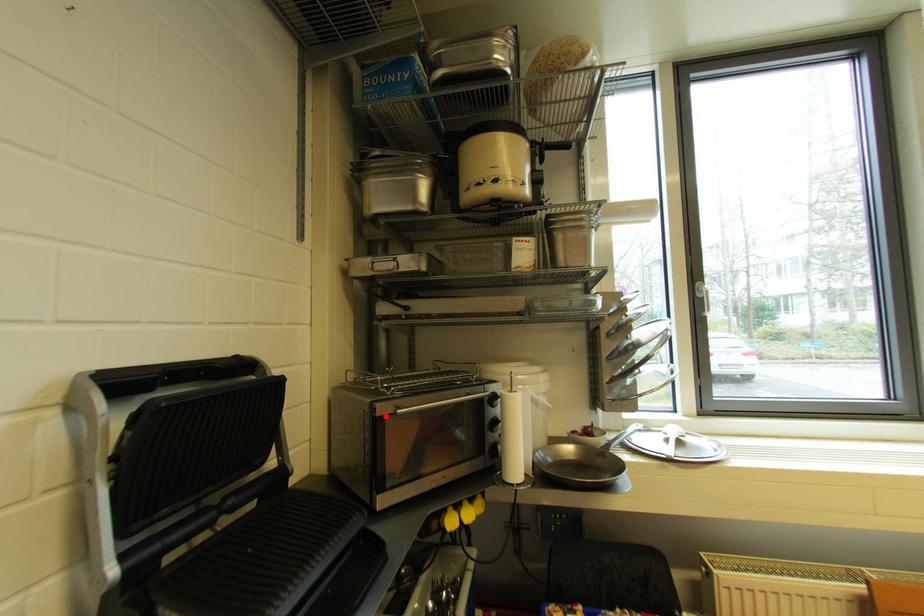
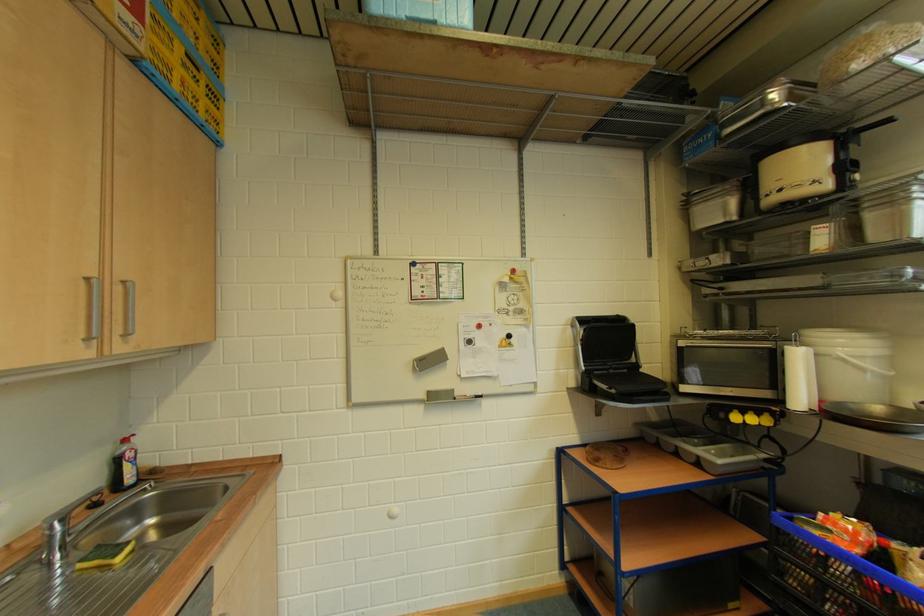
Locate, in the second image, the point that corresponds to the highlighted location in the first image.

(687, 347)